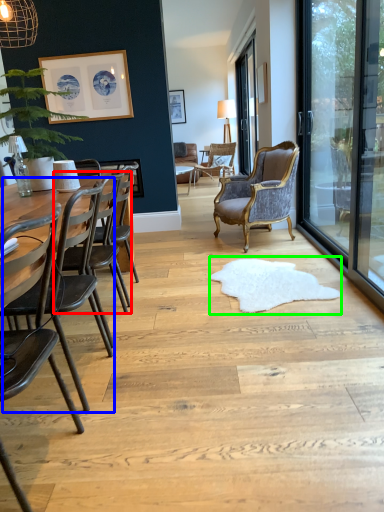
Question: Based on their relative distances, which object is nearer to chair (highlighted by a red box)? Choose from swivel chair (highlighted by a blue box) and mat (highlighted by a green box).

Choices:
 (A) swivel chair
 (B) mat

Answer: (A)